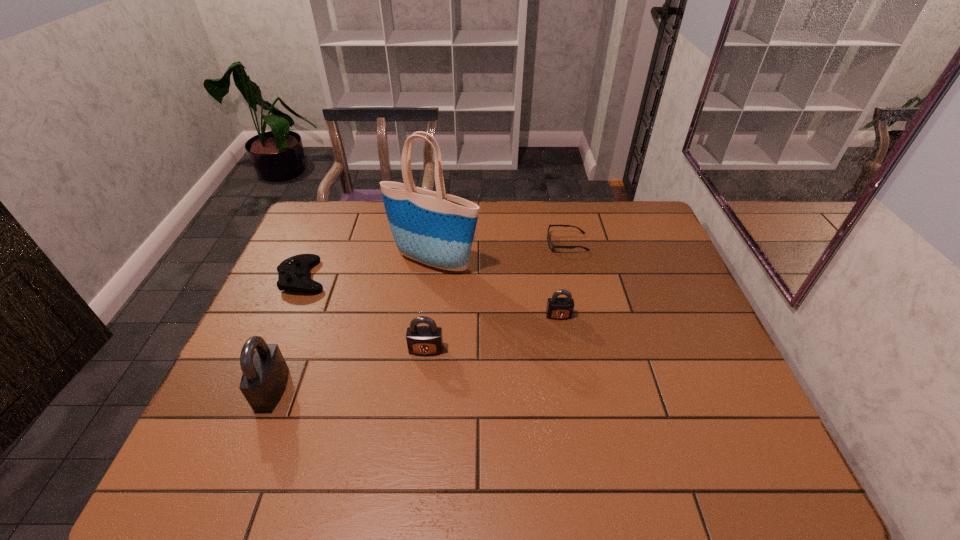
All padlocks are currently evenly spaced. To continue this pattern, where would you add another padlock on the right? Please point out a vacant spot. Please provide its 2D coordinates. Your answer should be formatted as a tuple, i.e. [(x, y)], where the tuple contains the x and y coordinates of a point satisfying the conditions above.

[(674, 286)]